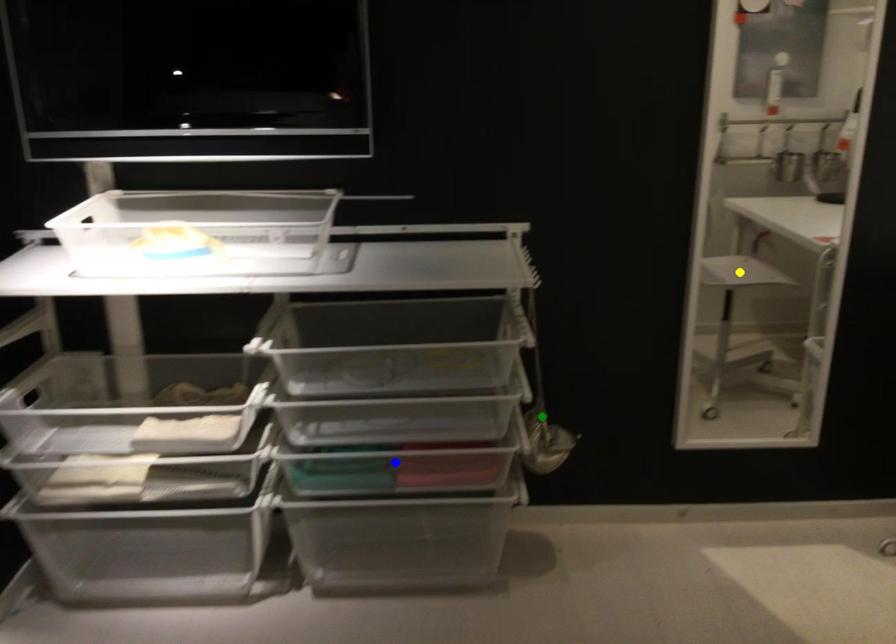
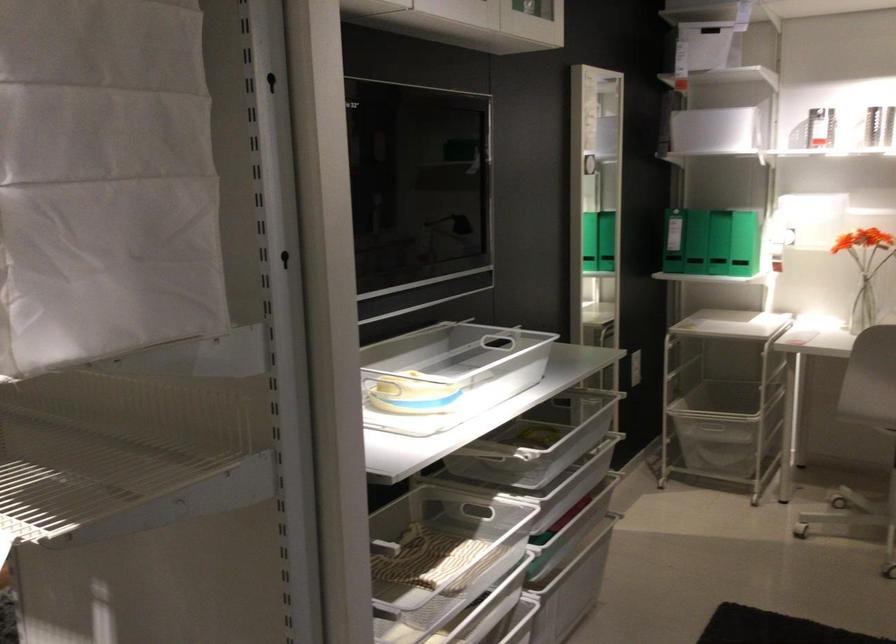
I am providing you with two images of the same scene from different viewpoints. Three points are marked in image1. Which point corresponds to a part or object that is occluded in image2?In image1, three points are marked. Which of them correspond to a part or object that is occluded in image2?Among the three points shown in image1, which one corresponds to a part or object that is no longer visible due to occlusion in image2?

blue point, yellow point, green point cannot be seen in image2.